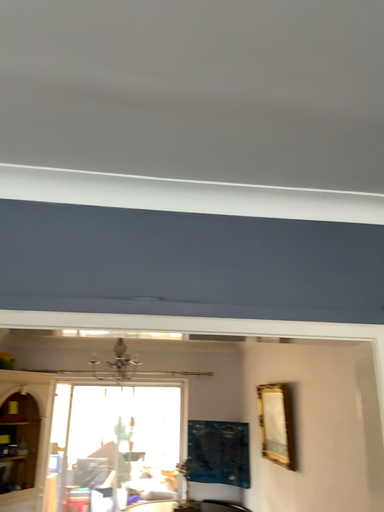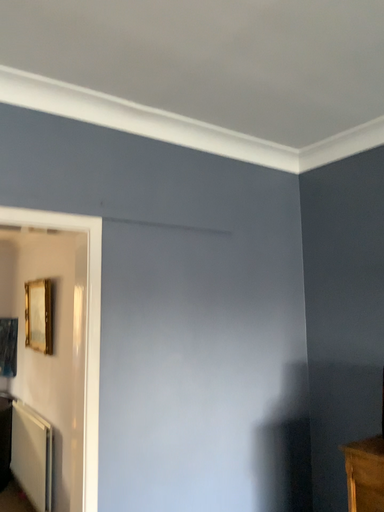
Question: How did the camera likely rotate when shooting the video?

Choices:
 (A) rotated downward
 (B) rotated upward

Answer: (A)